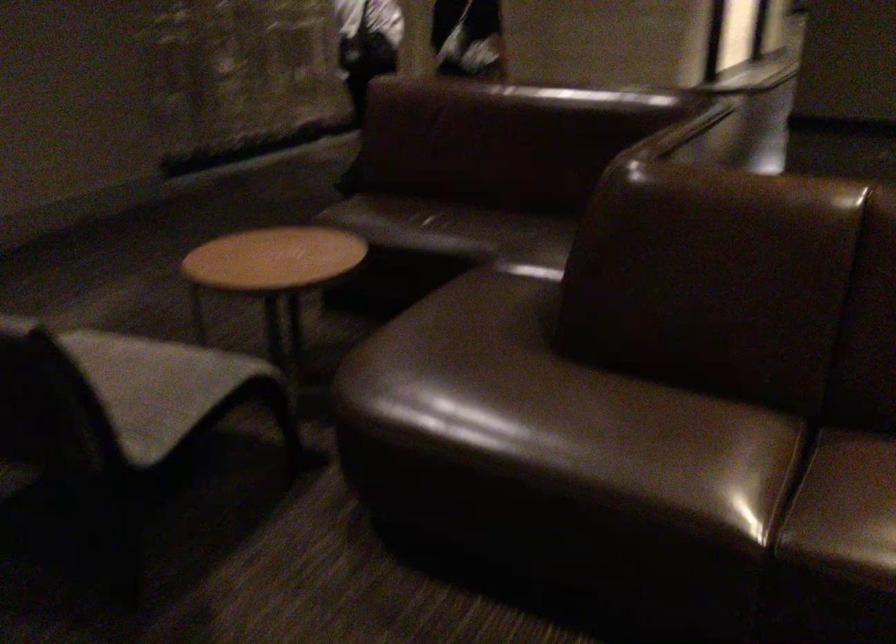
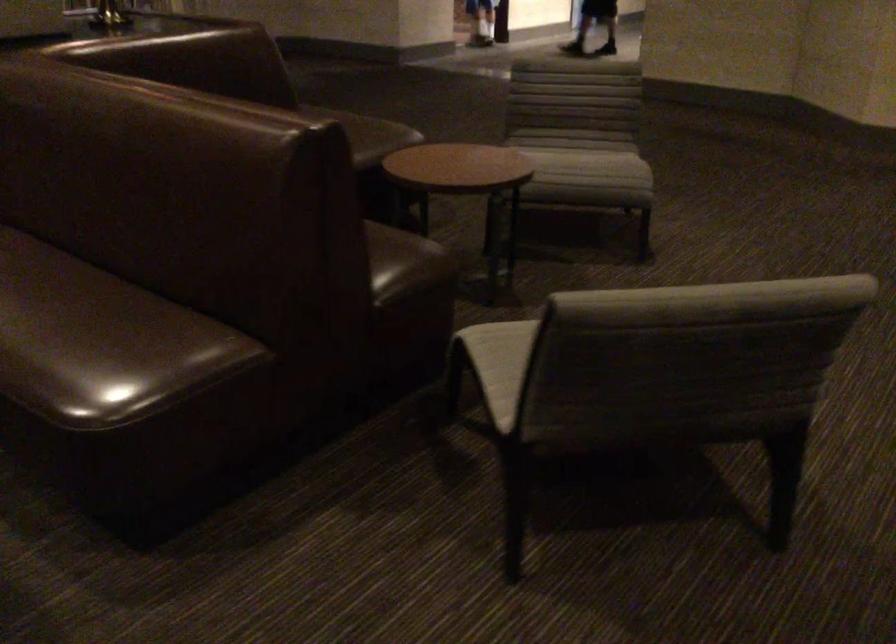
Question: The images are taken continuously from a first-person perspective. In which direction are you moving?

Choices:
 (A) Left
 (B) Right
 (C) Forward
 (D) Backward

Answer: (B)